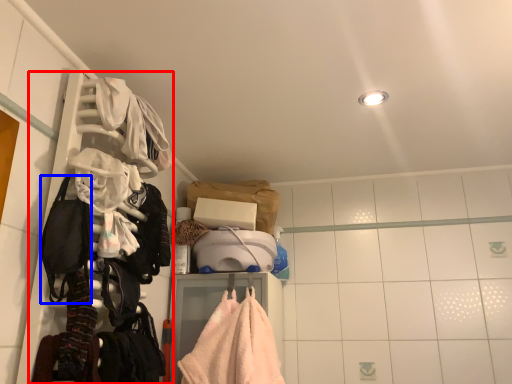
Question: Which of the following is the closest to the observer, closet (highlighted by a red box) or gear (highlighted by a blue box)?

Choices:
 (A) closet
 (B) gear

Answer: (A)